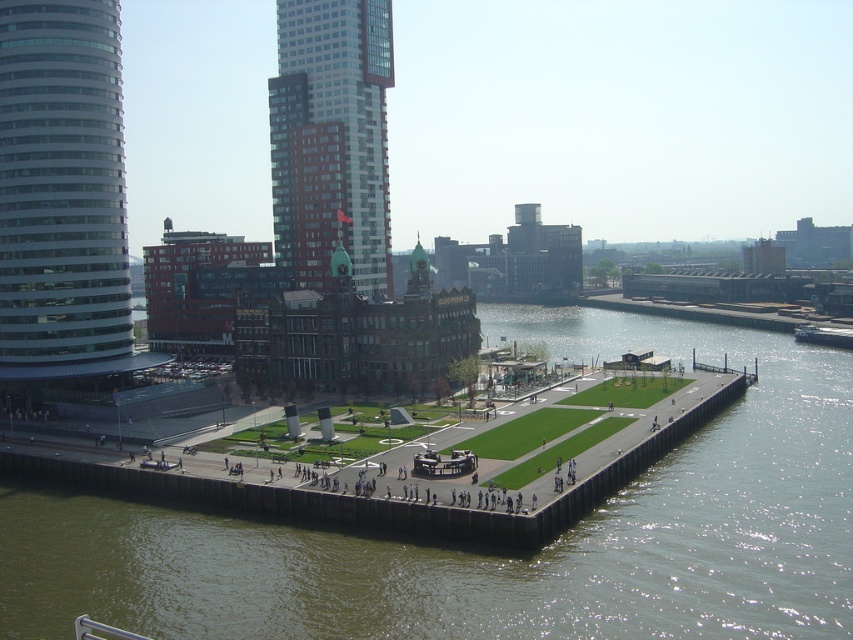
Question: Does green concrete river at lower center appear on the left side of glassy steel tower at left?

Choices:
 (A) yes
 (B) no

Answer: (B)

Question: Estimate the real-world distances between objects in this image. Which object is farther from the red brick building at center?

Choices:
 (A) glassy steel tower at left
 (B) green concrete river at lower center

Answer: (B)

Question: Among these points, which one is nearest to the camera?

Choices:
 (A) (375, 65)
 (B) (25, 365)
 (C) (283, 616)

Answer: (C)

Question: Does green concrete river at lower center have a larger size compared to glassy steel tower at left?

Choices:
 (A) no
 (B) yes

Answer: (B)

Question: Is glassy steel tower at left in front of red brick building at center?

Choices:
 (A) yes
 (B) no

Answer: (A)

Question: Estimate the real-world distances between objects in this image. Which object is farther from the red brick building at center?

Choices:
 (A) glassy steel tower at left
 (B) green concrete river at lower center

Answer: (B)